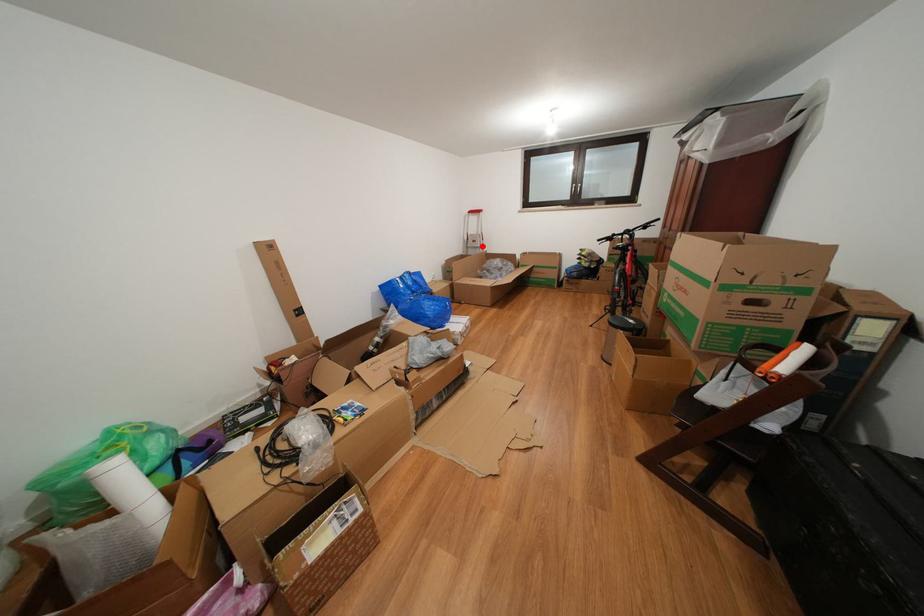
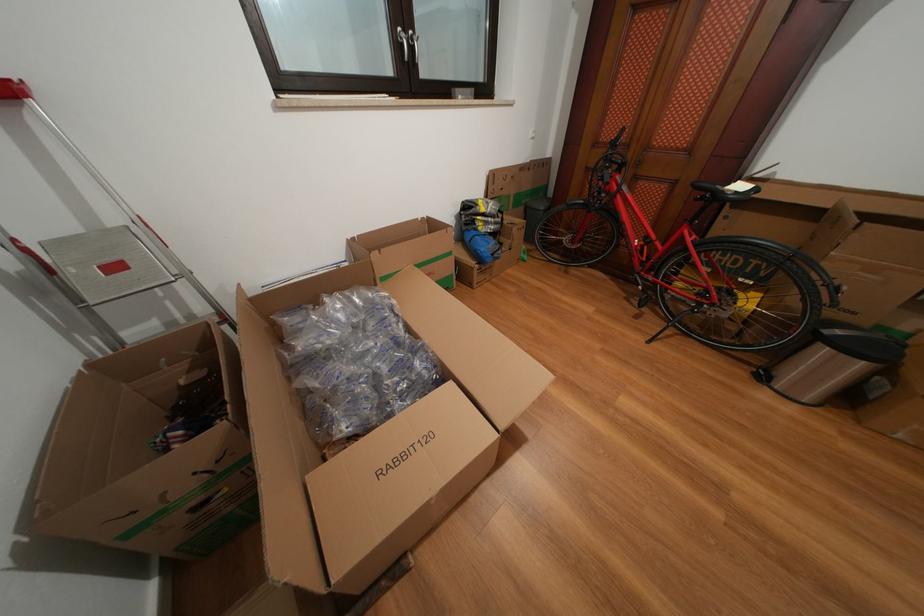
Question: I am providing you with two images of the same scene from different viewpoints. A red point is shown in image1. For the corresponding object point in image2, is it positioned nearer or farther from the camera?

Choices:
 (A) Nearer
 (B) Farther

Answer: (B)